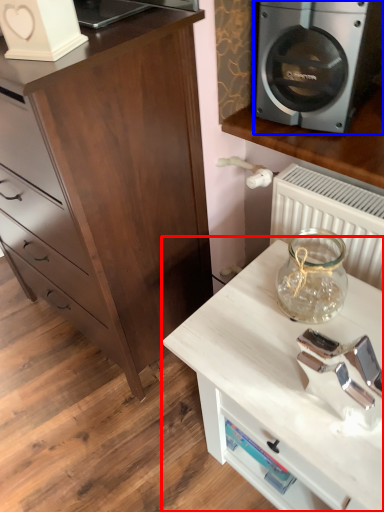
Question: Which object is further to the camera taking this photo, table (highlighted by a red box) or home appliance (highlighted by a blue box)?

Choices:
 (A) table
 (B) home appliance

Answer: (B)